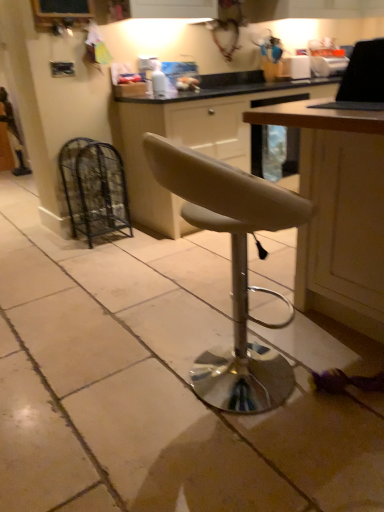
Locate an element on the screen. The width and height of the screenshot is (384, 512). vacant area located to the right-hand side of black wire mesh cage at left is located at coordinates (143, 240).